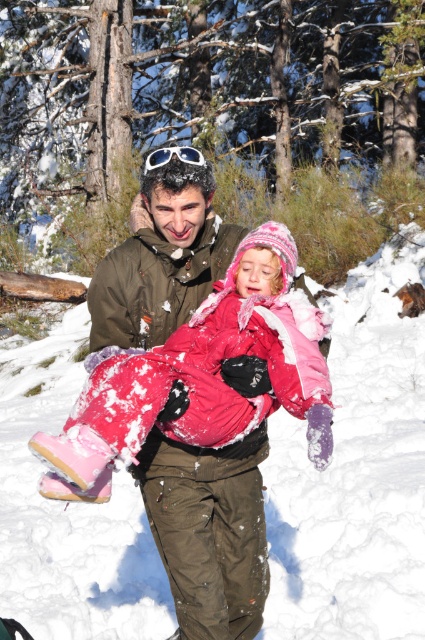
You are planning to place a small decorative snowman between the white fluffy snow at center and the white matte goggles at upper center. Which object should the snowman be closer to to ensure it fits within the available space?

The snowman should be closer to the white fluffy snow at center because it is wider than the white matte goggles at upper center, allowing more space for the snowman to be placed near it.

You are a photographer trying to capture a photo of the fluffy pink snowsuit at center and the white matte goggles at upper center. Which object should you focus on first if you want to ensure both are in focus without adjusting the camera settings?

The fluffy pink snowsuit at center is much taller than the white matte goggles at upper center, so focusing on the taller object first will help ensure both are in focus.

In the scene shown: You are standing in the winter scene and want to place a small snowman exactly where the white fluffy snow at center is. Is the location suitable for building the snowman?

The white fluffy snow at center is located at point (356, 472), which is a suitable location for building a snowman as it provides a stable base of snow.